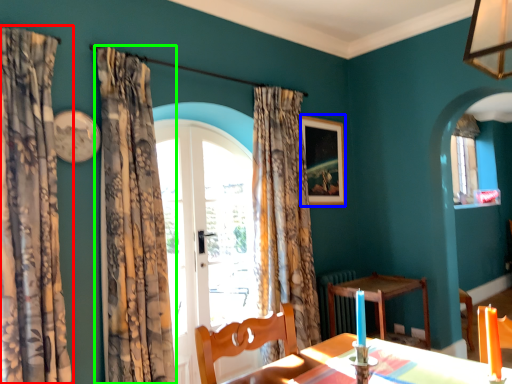
Question: Which object is the farthest from curtain (highlighted by a red box)? Choose among these: picture frame (highlighted by a blue box) or curtain (highlighted by a green box).

Choices:
 (A) picture frame
 (B) curtain

Answer: (A)